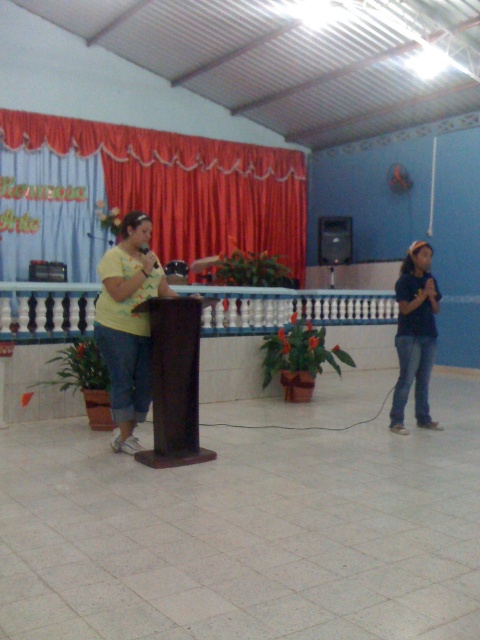
Question: Which of these objects is positioned farthest from the yellow matte shirt at center?

Choices:
 (A) denim jeans at right
 (B) red velvet curtain at upper center

Answer: (B)

Question: Which point is closer to the camera?

Choices:
 (A) (207, 152)
 (B) (409, 294)
 (C) (101, 337)

Answer: (C)

Question: Among these objects, which one is nearest to the camera?

Choices:
 (A) red velvet curtain at upper center
 (B) denim jeans at right

Answer: (B)

Question: Does red velvet curtain at upper center come behind denim jeans at right?

Choices:
 (A) yes
 (B) no

Answer: (A)

Question: Does yellow matte shirt at center appear over denim jeans at right?

Choices:
 (A) yes
 (B) no

Answer: (A)

Question: Is red velvet curtain at upper center above denim jeans at right?

Choices:
 (A) yes
 (B) no

Answer: (A)